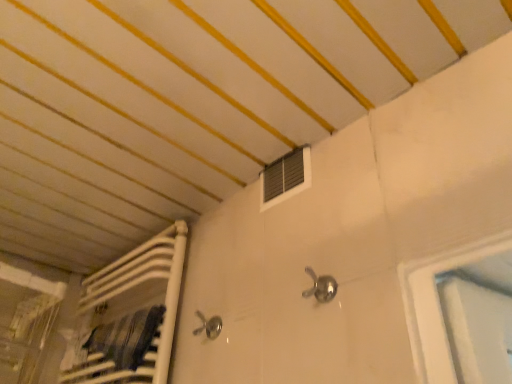
Question: Which direction should I rotate to look at metallic silver air conditioning at upper center?

Choices:
 (A) left
 (B) right

Answer: (B)

Question: Is satin nickel faucet at center shorter than metallic silver air conditioning at upper center?

Choices:
 (A) no
 (B) yes

Answer: (B)

Question: Is satin nickel faucet at center to the left of metallic silver air conditioning at upper center from the viewer's perspective?

Choices:
 (A) yes
 (B) no

Answer: (B)

Question: Can you confirm if satin nickel faucet at center is wider than metallic silver air conditioning at upper center?

Choices:
 (A) yes
 (B) no

Answer: (A)

Question: Does satin nickel faucet at center have a larger size compared to metallic silver air conditioning at upper center?

Choices:
 (A) yes
 (B) no

Answer: (B)

Question: Are satin nickel faucet at center and metallic silver air conditioning at upper center far apart?

Choices:
 (A) yes
 (B) no

Answer: (B)

Question: From the image's perspective, would you say satin nickel faucet at center is shown under metallic silver air conditioning at upper center?

Choices:
 (A) yes
 (B) no

Answer: (A)

Question: Is metallic silver air conditioning at upper center facing away from satin nickel faucet at center?

Choices:
 (A) no
 (B) yes

Answer: (A)

Question: Is metallic silver air conditioning at upper center bigger than satin nickel faucet at center?

Choices:
 (A) no
 (B) yes

Answer: (B)

Question: Is metallic silver air conditioning at upper center completely or partially outside of satin nickel faucet at center?

Choices:
 (A) no
 (B) yes

Answer: (B)

Question: Is the position of metallic silver air conditioning at upper center less distant than that of satin nickel faucet at center?

Choices:
 (A) no
 (B) yes

Answer: (A)

Question: Would you say metallic silver air conditioning at upper center is a long distance from satin nickel faucet at center?

Choices:
 (A) no
 (B) yes

Answer: (A)

Question: From a real-world perspective, is metallic silver air conditioning at upper center over satin nickel faucet at center?

Choices:
 (A) no
 (B) yes

Answer: (B)

Question: In terms of size, does satin nickel faucet at center appear bigger or smaller than metallic silver air conditioning at upper center?

Choices:
 (A) small
 (B) big

Answer: (A)